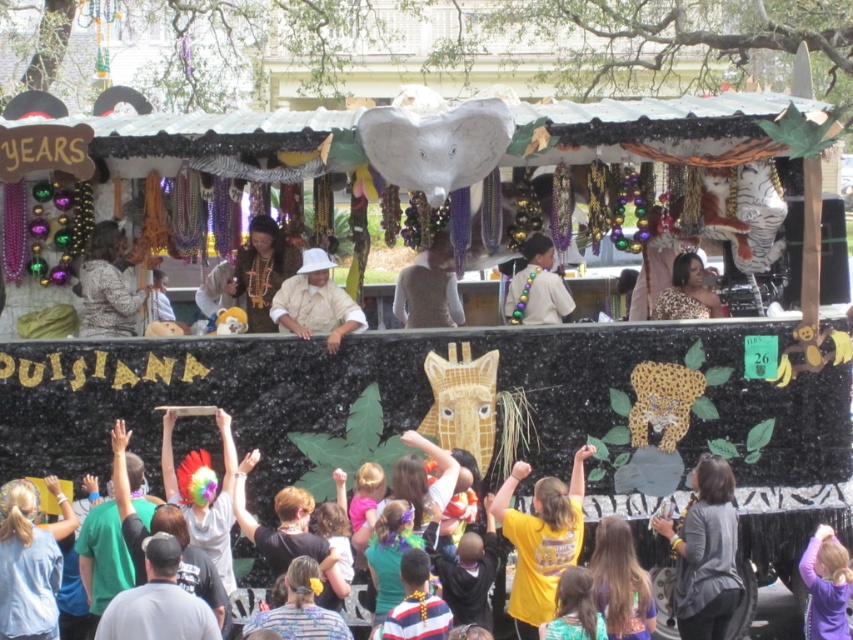
Image resolution: width=853 pixels, height=640 pixels. Describe the element at coordinates (537, 285) in the screenshot. I see `beige fabric lei at center` at that location.

Between beige fabric lei at center and smooth brown hair at lower center, which one has less height?

With less height is smooth brown hair at lower center.

Is point (521, 275) positioned before point (552, 620)?

That is False.

I want to click on beige fabric lei at center, so click(537, 285).

Describe the element at coordinates (315, 301) in the screenshot. I see `white matte hat at center` at that location.

Which is in front, point (289, 308) or point (415, 266)?

Positioned in front is point (289, 308).

The width and height of the screenshot is (853, 640). Describe the element at coordinates (315, 301) in the screenshot. I see `white matte hat at center` at that location.

Image resolution: width=853 pixels, height=640 pixels. Identify the location of white matte hat at center. (315, 301).

Can you confirm if white matte hat at center is smaller than beige fabric lei at center?

No.

Who is taller, white matte hat at center or beige fabric lei at center?

white matte hat at center

Locate an element on the screen. This screenshot has width=853, height=640. white matte hat at center is located at coordinates (315, 301).

Image resolution: width=853 pixels, height=640 pixels. What are the coordinates of `white matte hat at center` in the screenshot? It's located at (315, 301).